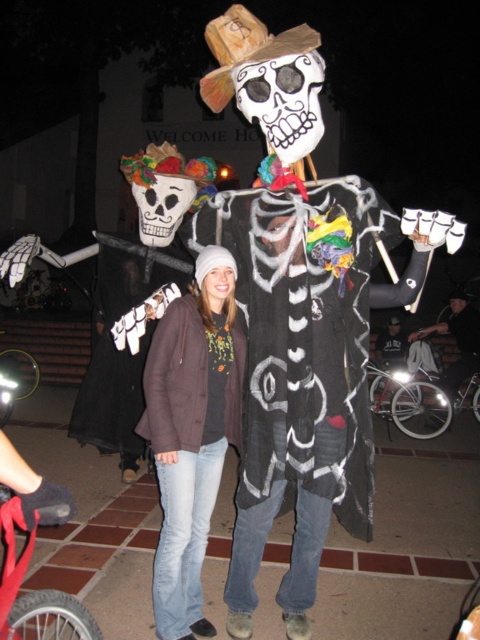
Question: Which object appears closest to the camera in this image?

Choices:
 (A) denim jeans at center
 (B) dark gray fabric pants at lower right

Answer: (A)

Question: Does denim jeans at center have a larger size compared to dark gray fabric pants at lower right?

Choices:
 (A) yes
 (B) no

Answer: (B)

Question: Can you confirm if denim jeans at center is positioned below dark gray fabric pants at lower right?

Choices:
 (A) yes
 (B) no

Answer: (A)

Question: Which point is closer to the camera taking this photo?

Choices:
 (A) (447, 316)
 (B) (163, 474)

Answer: (B)

Question: Can you confirm if denim jeans at center is positioned to the right of dark gray fabric pants at lower right?

Choices:
 (A) yes
 (B) no

Answer: (B)

Question: Which object appears closest to the camera in this image?

Choices:
 (A) denim jeans at center
 (B) dark gray fabric pants at lower right

Answer: (A)